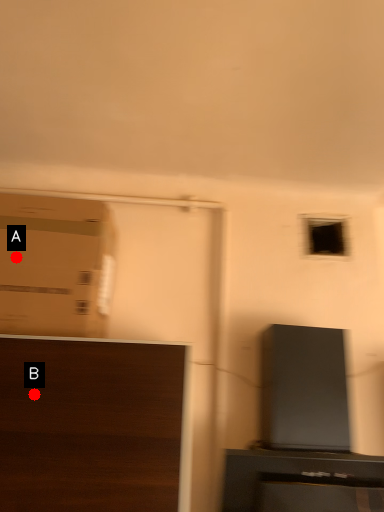
Question: Two points are circled on the image, labeled by A and B beside each circle. Which point appears closest to the camera in this image?

Choices:
 (A) A is closer
 (B) B is closer

Answer: (B)